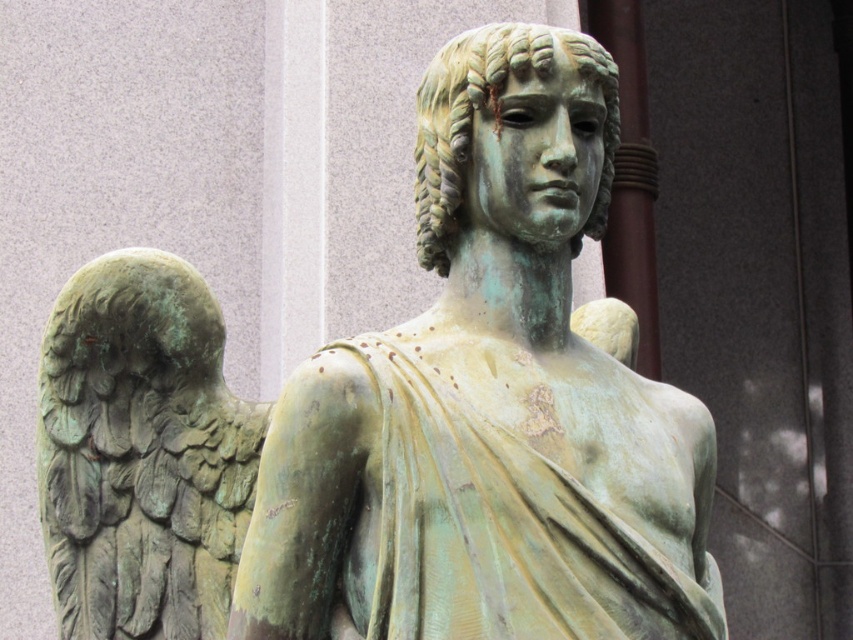
Between green patina statue at center and green patina wings at left, which one has less height?

With less height is green patina wings at left.

Is point (556, 49) positioned after point (212, 390)?

No, (556, 49) is closer to viewer.

The width and height of the screenshot is (853, 640). What do you see at coordinates (488, 404) in the screenshot?
I see `green patina statue at center` at bounding box center [488, 404].

Where is `green patina statue at center`? green patina statue at center is located at coordinates click(488, 404).